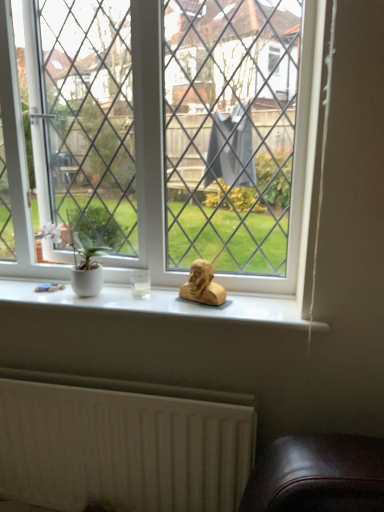
Question: Is matte gold bust at center inside the boundaries of clear glass window at center, or outside?

Choices:
 (A) inside
 (B) outside

Answer: (B)

Question: Considering the positions of matte gold bust at center and clear glass window at center in the image, is matte gold bust at center taller or shorter than clear glass window at center?

Choices:
 (A) short
 (B) tall

Answer: (A)

Question: Which object is the farthest from the clear glass window at center?

Choices:
 (A) matte gold bust at center
 (B) white textured radiator at lower left

Answer: (B)

Question: Which object is positioned farthest from the matte gold bust at center?

Choices:
 (A) white textured radiator at lower left
 (B) clear glass window at center

Answer: (A)